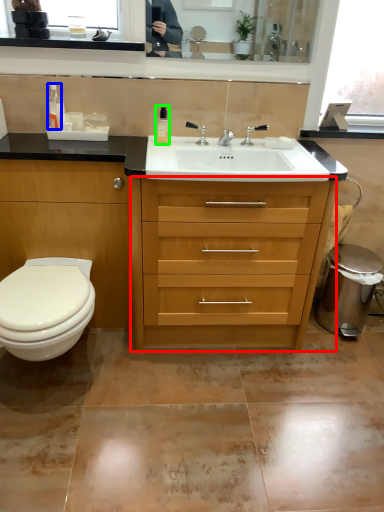
Question: Which is nearer to the chest of drawers (highlighted by a red box)? toiletry (highlighted by a blue box) or toiletry (highlighted by a green box).

Choices:
 (A) toiletry
 (B) toiletry

Answer: (B)